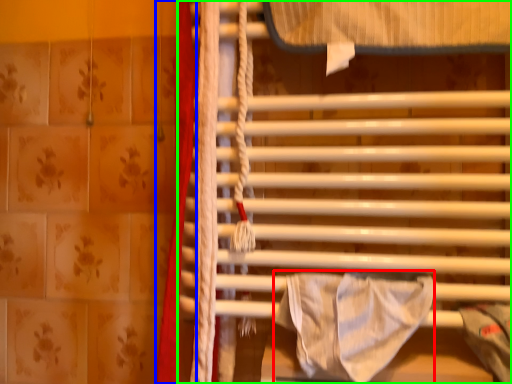
Question: Which is farther away from blanket (highlighted by a red box)? curtain (highlighted by a blue box) or furniture (highlighted by a green box)?

Choices:
 (A) curtain
 (B) furniture

Answer: (A)